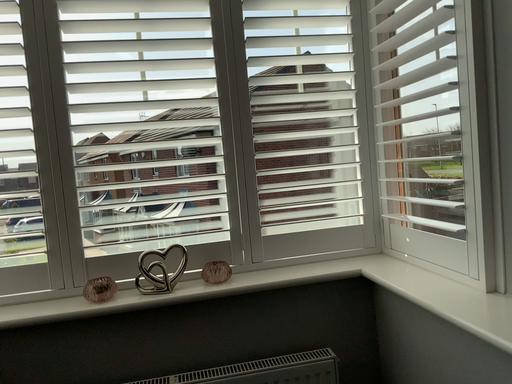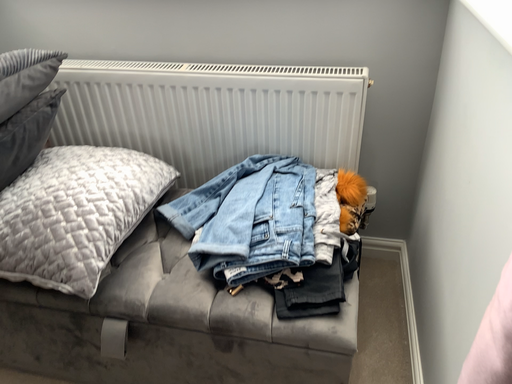
Question: How did the camera likely rotate when shooting the video?

Choices:
 (A) rotated upward
 (B) rotated downward

Answer: (B)